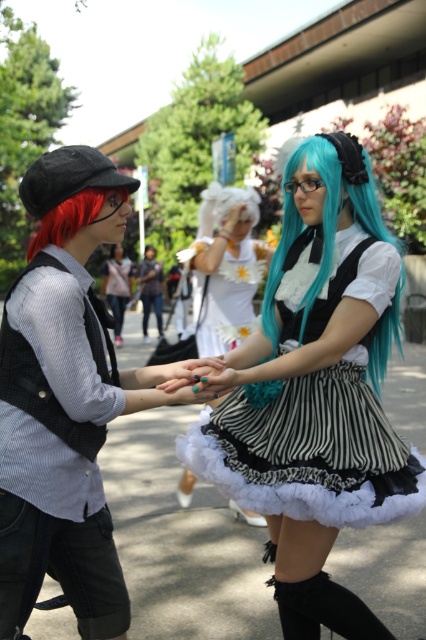
Question: Which is farther from the blonde hair at center?

Choices:
 (A) matte black vest at left
 (B) vivid red hair at left
 (C) black and white striped dress at center

Answer: (B)

Question: Observing the image, what is the correct spatial positioning of matte black vest at left in reference to teal silky wig at center?

Choices:
 (A) below
 (B) above

Answer: (A)

Question: Which object appears closest to the camera in this image?

Choices:
 (A) teal silky wig at center
 (B) matte black dress at center
 (C) teal nail polish at center

Answer: (B)

Question: Does matte black dress at center appear under matte black vest at left?

Choices:
 (A) yes
 (B) no

Answer: (B)

Question: Among these points, which one is farthest from the camera?

Choices:
 (A) click(x=11, y=545)
 (B) click(x=146, y=257)
 (C) click(x=201, y=365)
 (D) click(x=239, y=218)

Answer: (B)

Question: Is matte black dress at center to the right of black and white striped dress at center from the viewer's perspective?

Choices:
 (A) no
 (B) yes

Answer: (A)